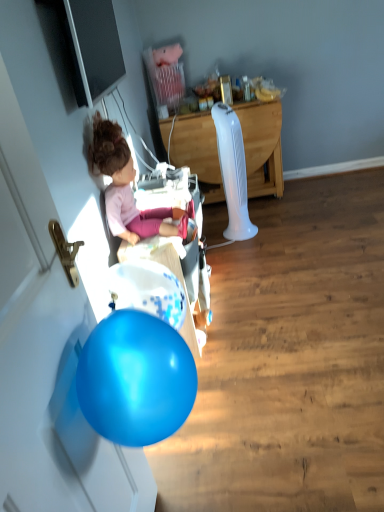
At what (x,y) coordinates should I click in order to perform the action: click on free spot in front of white plastic fan at center. Please return your answer as a coordinate pair (x, y). Looking at the image, I should click on (276, 227).